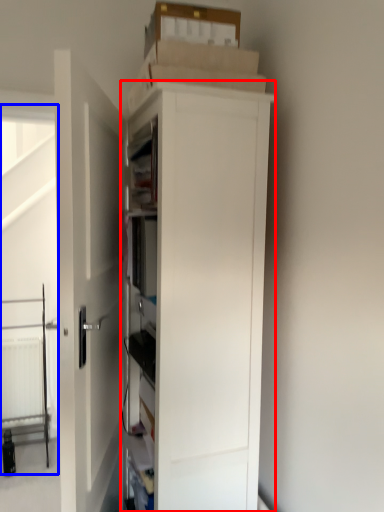
Question: Which object is further to the camera taking this photo, cupboard (highlighted by a red box) or screen door (highlighted by a blue box)?

Choices:
 (A) cupboard
 (B) screen door

Answer: (B)